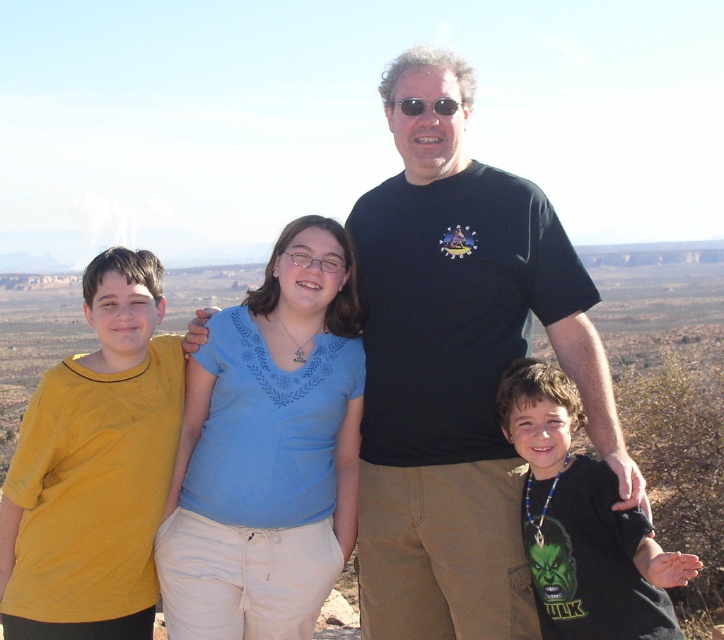
Does point (613, 429) lie behind point (665, 564)?

Yes.

Does black cotton t-shirt at center have a lesser height compared to black matte shirt at lower right?

No.

Between point (521, 188) and point (654, 588), which one is positioned in front?

Point (654, 588)

At what (x,y) coordinates should I click in order to perform the action: click on black cotton t-shirt at center. Please return your answer as a coordinate pair (x, y). The image size is (724, 640). Looking at the image, I should click on (x=458, y=368).

Can you confirm if blue cotton shirt at center is wider than black matte shirt at lower right?

No.

Between blue cotton shirt at center and black matte shirt at lower right, which one is positioned higher?

blue cotton shirt at center is above.

Is point (332, 532) behind point (510, 429)?

Yes, it is.

You are a GUI agent. You are given a task and a screenshot of the screen. Output one action in this format:
    pyautogui.click(x=<x>, y=<y>)
    Task: Click on the blue cotton shirt at center
    This screenshot has height=640, width=724.
    Given the screenshot: What is the action you would take?
    pyautogui.click(x=269, y=451)

In the scene shown: Does yellow cotton shirt at left have a smaller size compared to black matte shirt at lower right?

Correct, yellow cotton shirt at left occupies less space than black matte shirt at lower right.

What do you see at coordinates (93, 468) in the screenshot?
I see `yellow cotton shirt at left` at bounding box center [93, 468].

Identify the location of yellow cotton shirt at left. click(x=93, y=468).